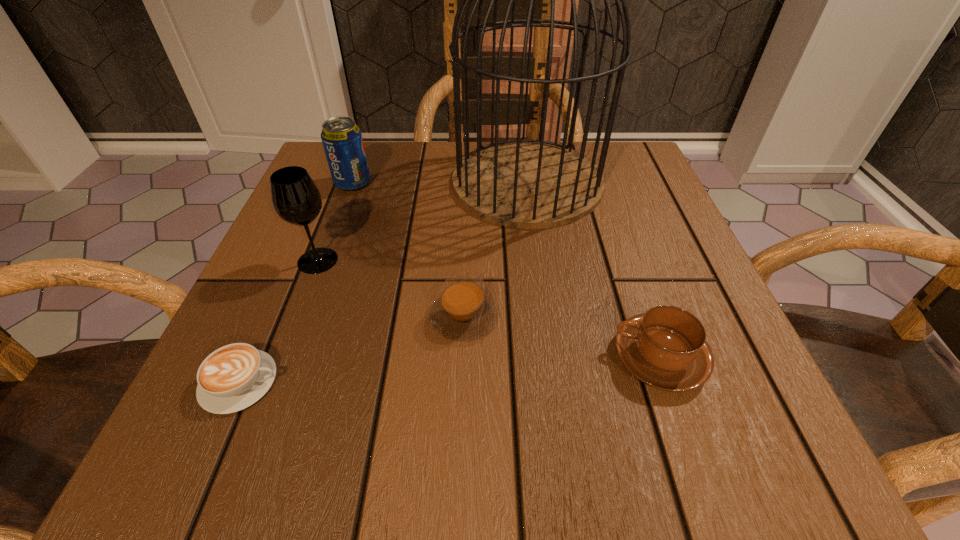
Find the location of a particular element. This screenshot has width=960, height=540. vacant space located at the door of the birdcage is located at coordinates (391, 182).

Where is `free space located 0.150m at the door of the birdcage`? The width and height of the screenshot is (960, 540). free space located 0.150m at the door of the birdcage is located at coordinates (382, 182).

This screenshot has height=540, width=960. Identify the location of vacant area situated 0.170m on the right of the third farthest object. [437, 260].

Identify the location of free region located 0.230m on the front of the soda. The width and height of the screenshot is (960, 540). (320, 272).

This screenshot has width=960, height=540. Identify the location of vacant space located on the side of the rightmost cappuccino with the handle. (500, 357).

You are a GUI agent. You are given a task and a screenshot of the screen. Output one action in this format:
    pyautogui.click(x=<x>, y=<y>)
    Task: Click on the free space located on the side of the rightmost cappuccino with the handle
    
    Given the screenshot: What is the action you would take?
    pyautogui.click(x=372, y=357)

In order to click on free location located 0.350m on the side of the rightmost cappuccino with the handle in this screenshot , I will do `click(365, 357)`.

Where is `vacant space positioned on the back of the fifth tallest object`? The width and height of the screenshot is (960, 540). vacant space positioned on the back of the fifth tallest object is located at coordinates pyautogui.click(x=466, y=242).

What are the coordinates of `vacant space located on the side of the shortest object with the handle` in the screenshot? It's located at (480, 382).

The height and width of the screenshot is (540, 960). What are the coordinates of `birdcage that is at the far edge` in the screenshot? It's located at (523, 183).